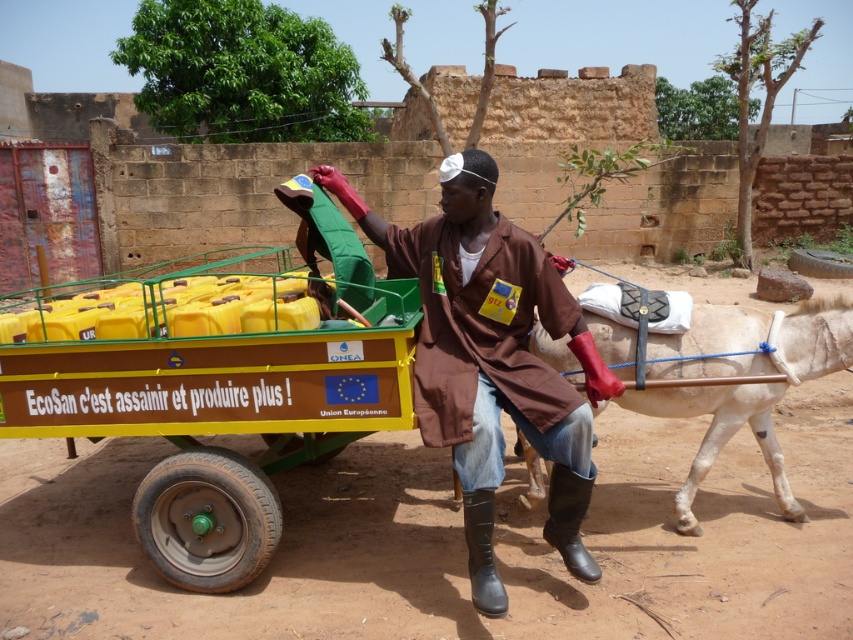
You are a photographer trying to capture the entire scene in one shot. The brown fabric coat at center and the white smooth mule at lower right are both in your frame. Which object appears narrower in your photo?

The brown fabric coat at center appears narrower in the photo because it has a lesser width compared to the white smooth mule at lower right.

You are a photographer trying to capture the man and the donkey in a single frame. The camera you have can only focus on objects within a 1.5 meter width. Given that the brown fabric coat at center is bigger than the white smooth mule at lower right, will both fit in the frame?

The brown fabric coat at center is bigger than the white smooth mule at lower right, but the question is about their width. Since the camera can focus on objects within a 1.5 meter width, and the description only mentions size comparison without specific measurements, it is unclear if both will fit. However, since the coat is at the center and the mule is at the lower right, their positions might allow them to fit within the frame if positioned correctly.